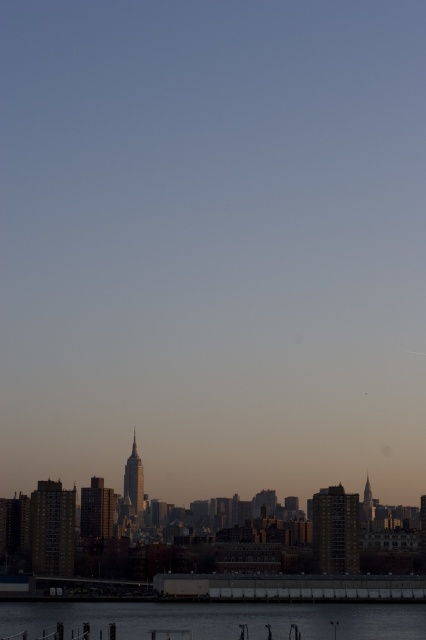
You are standing on the pier and want to walk to the concrete dock at lower center. Which direction should you move relative to the clear water at lower center to reach the dock?

You should move to the right relative to the clear water at lower center to reach the concrete dock at lower center because the clear water at lower center is to the left of the concrete dock at lower center.

Based on the photo, you are standing at the pier looking towards the city skyline. There are two points marked on the image. One is at coordinates point (310, 609) and the other at point (166, 573). Which point is closer to you?

Point (166, 573) is closer to you because it is less further to the camera than point (310, 609).